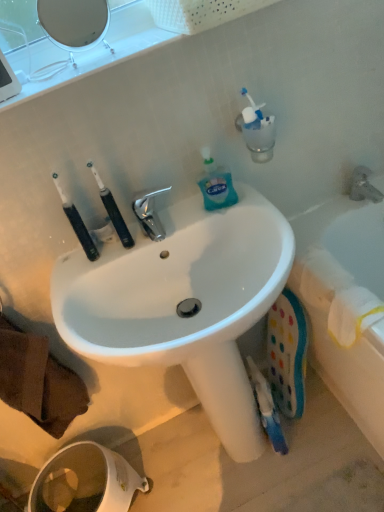
Question: Should I look upward or downward to see black rubber toothbrush at left?

Choices:
 (A) up
 (B) down

Answer: (A)

Question: Can you confirm if black rubber toothbrush at left is positioned to the right of translucent plastic bottle at upper right?

Choices:
 (A) yes
 (B) no

Answer: (B)

Question: Does black rubber toothbrush at left turn towards translucent plastic bottle at upper right?

Choices:
 (A) yes
 (B) no

Answer: (B)

Question: From a real-world perspective, is black rubber toothbrush at left positioned over translucent plastic bottle at upper right based on gravity?

Choices:
 (A) no
 (B) yes

Answer: (B)

Question: Are black rubber toothbrush at left and translucent plastic bottle at upper right located far from each other?

Choices:
 (A) no
 (B) yes

Answer: (A)

Question: Is black rubber toothbrush at left not inside translucent plastic bottle at upper right?

Choices:
 (A) no
 (B) yes

Answer: (B)

Question: Is black rubber toothbrush at left shorter than translucent plastic bottle at upper right?

Choices:
 (A) yes
 (B) no

Answer: (B)

Question: Is translucent plastic bottle at upper right further to the viewer compared to white glossy mirror at upper left?

Choices:
 (A) yes
 (B) no

Answer: (A)

Question: Is translucent plastic bottle at upper right far away from white glossy mirror at upper left?

Choices:
 (A) yes
 (B) no

Answer: (B)

Question: Does translucent plastic bottle at upper right have a smaller size compared to white glossy mirror at upper left?

Choices:
 (A) no
 (B) yes

Answer: (B)

Question: Does translucent plastic bottle at upper right have a greater width compared to white glossy mirror at upper left?

Choices:
 (A) yes
 (B) no

Answer: (A)

Question: Considering the relative sizes of translucent plastic bottle at upper right and white glossy mirror at upper left in the image provided, is translucent plastic bottle at upper right thinner than white glossy mirror at upper left?

Choices:
 (A) no
 (B) yes

Answer: (A)

Question: Is translucent plastic bottle at upper right facing away from white glossy mirror at upper left?

Choices:
 (A) no
 (B) yes

Answer: (A)

Question: Is black rubber toothbrush at left to the left of white glossy toilet paper at lower left from the viewer's perspective?

Choices:
 (A) no
 (B) yes

Answer: (A)